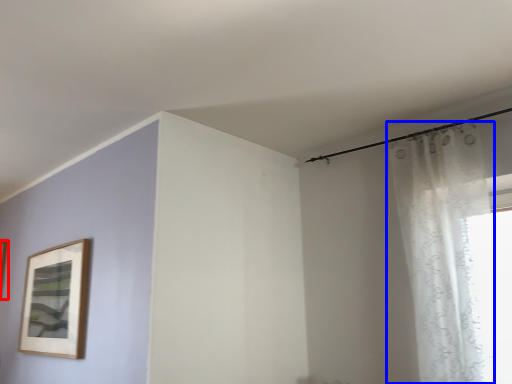
Question: Among these objects, which one is nearest to the camera, picture frame (highlighted by a red box) or curtain (highlighted by a blue box)?

Choices:
 (A) picture frame
 (B) curtain

Answer: (B)